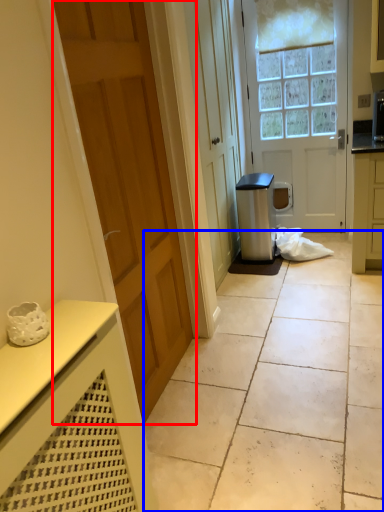
Question: Which object appears closest to the camera in this image, door (highlighted by a red box) or concrete (highlighted by a blue box)?

Choices:
 (A) door
 (B) concrete

Answer: (A)